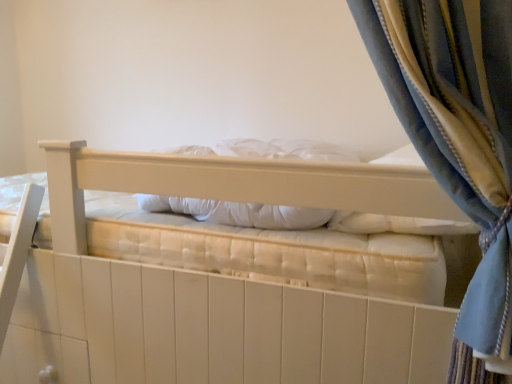
Question: Does white soft pillow at center have a greater height compared to white quilted mattress at center?

Choices:
 (A) no
 (B) yes

Answer: (A)

Question: Is white soft pillow at center bigger than white quilted mattress at center?

Choices:
 (A) no
 (B) yes

Answer: (A)

Question: Does white soft pillow at center lie in front of white quilted mattress at center?

Choices:
 (A) no
 (B) yes

Answer: (A)

Question: Is white soft pillow at center further to the viewer compared to white quilted mattress at center?

Choices:
 (A) no
 (B) yes

Answer: (B)

Question: Can you confirm if white soft pillow at center is shorter than white quilted mattress at center?

Choices:
 (A) no
 (B) yes

Answer: (B)

Question: Could white quilted mattress at center be considered to be inside white soft pillow at center?

Choices:
 (A) yes
 (B) no

Answer: (B)

Question: Does white quilted mattress at center turn towards white soft pillow at center?

Choices:
 (A) no
 (B) yes

Answer: (A)

Question: From the image's perspective, does white quilted mattress at center appear lower than white soft pillow at center?

Choices:
 (A) no
 (B) yes

Answer: (B)

Question: Can you confirm if white quilted mattress at center is smaller than white soft pillow at center?

Choices:
 (A) yes
 (B) no

Answer: (B)

Question: Does white quilted mattress at center have a larger size compared to white soft pillow at center?

Choices:
 (A) no
 (B) yes

Answer: (B)

Question: Does white quilted mattress at center contain white soft pillow at center?

Choices:
 (A) yes
 (B) no

Answer: (A)

Question: Can you confirm if white quilted mattress at center is wider than white soft pillow at center?

Choices:
 (A) yes
 (B) no

Answer: (A)

Question: In terms of size, does white quilted mattress at center appear bigger or smaller than white soft pillow at center?

Choices:
 (A) small
 (B) big

Answer: (B)